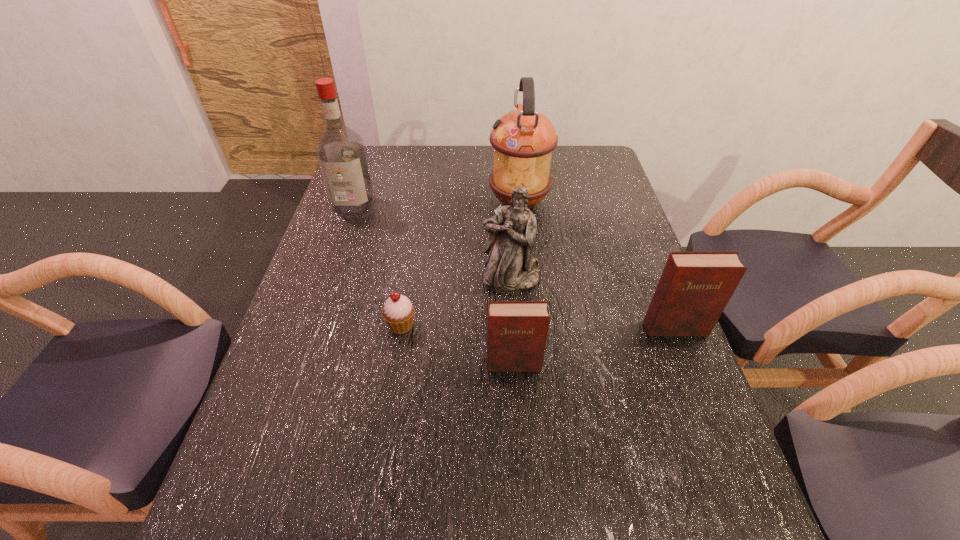
This screenshot has width=960, height=540. What are the coordinates of `vacant space at the left edge of the desktop` in the screenshot? It's located at (295, 360).

Identify the location of free location at the right edge. (602, 191).

The image size is (960, 540). In order to click on vacant space at the far left corner in this screenshot , I will do `click(372, 148)`.

Find the location of a particular element. Image resolution: width=960 pixels, height=540 pixels. free location at the far right corner is located at coordinates (571, 163).

This screenshot has height=540, width=960. In order to click on blank space at the near right corner of the desktop in this screenshot , I will do coord(650,483).

Where is `free space between the leftmost object and the oil lamp`? free space between the leftmost object and the oil lamp is located at coordinates (436, 204).

The height and width of the screenshot is (540, 960). In order to click on vacant space that is in between the shortest object and the leftmost object in this screenshot , I will do (377, 265).

What are the coordinates of `free space between the shortest object and the oil lamp` in the screenshot? It's located at (460, 264).

This screenshot has width=960, height=540. I want to click on empty location between the second object from left to right and the shorter diary, so click(457, 345).

Find the location of a particular element. The height and width of the screenshot is (540, 960). vacant area that lies between the right diary and the nearer diary is located at coordinates (594, 346).